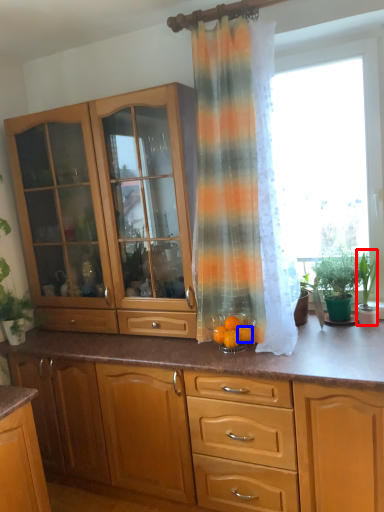
Question: Which object is closer to the camera taking this photo, houseplant (highlighted by a red box) or orange (highlighted by a blue box)?

Choices:
 (A) houseplant
 (B) orange

Answer: (B)